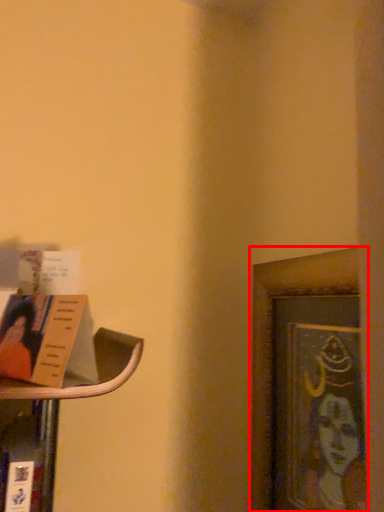
Question: From the image's perspective, where is picture frame (annotated by the red box) located in relation to book in the image?

Choices:
 (A) above
 (B) below

Answer: (B)